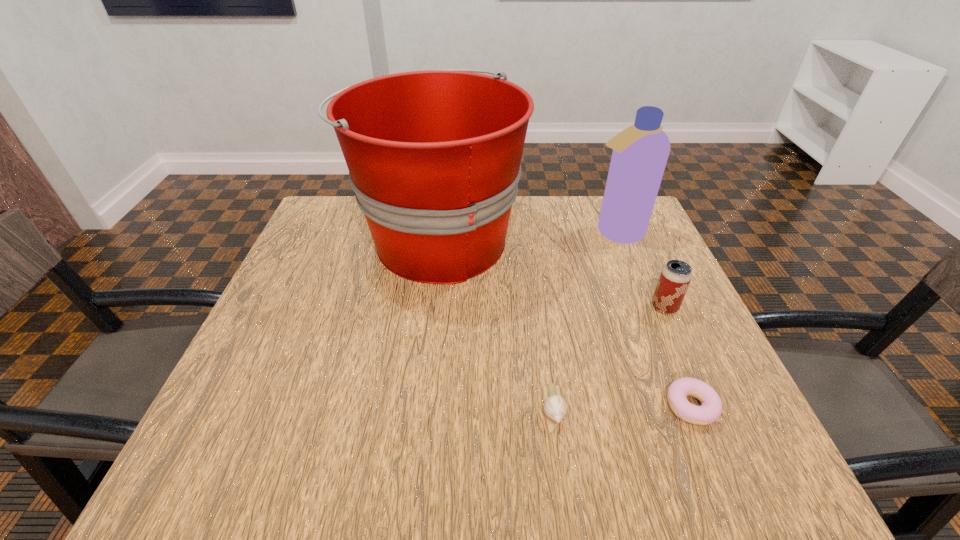
The width and height of the screenshot is (960, 540). In the image, there is a desktop. What are the coordinates of `vacant space at the far edge` in the screenshot? It's located at [566, 242].

This screenshot has height=540, width=960. In order to click on vacant space at the left edge of the desktop in this screenshot , I will do `click(253, 366)`.

I want to click on vacant region at the right edge of the desktop, so click(653, 309).

The image size is (960, 540). In order to click on vacant region at the far left corner in this screenshot , I will do `click(340, 202)`.

Find the location of `vacant area at the near left corner of the desktop`. vacant area at the near left corner of the desktop is located at coordinates (261, 443).

The height and width of the screenshot is (540, 960). In the image, there is a desktop. Identify the location of free space at the near right corner. (732, 433).

Locate an element on the screen. This screenshot has width=960, height=540. empty space that is in between the bucket and the beer can is located at coordinates [551, 273].

Image resolution: width=960 pixels, height=540 pixels. I want to click on free spot between the bucket and the doughnut, so click(x=564, y=323).

Locate an element on the screen. free area in between the beer can and the doughnut is located at coordinates (678, 357).

Find the location of a particular element. vacant point located between the third shortest object and the bucket is located at coordinates (551, 273).